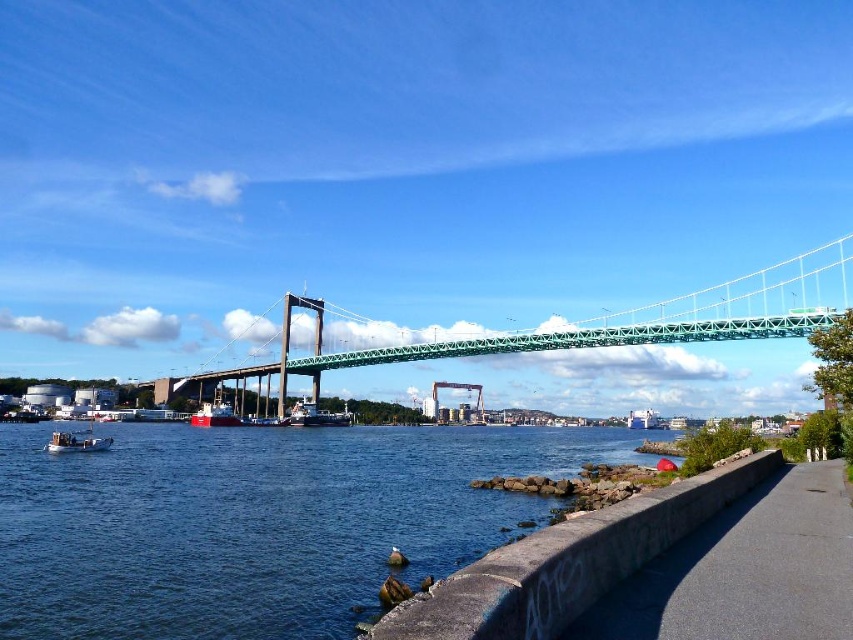
You are standing at the waterfront and want to reach the blue water at lower center. The safety regulations state that you must stay at least 30 meters away from the water for safety. Are you currently within the safe distance?

The distance of blue water at lower center from viewer is 27.16 meters, which is less than the required 30 meters. Therefore, you are not within the safe distance and need to move back.

Based on the photo, you are standing on the green deck of the large suspension bridge and looking down. You see a point labeled with coordinates. Which object is located at point (258, 522)?

The point at coordinates (258, 522) indicates blue water at lower center.

You are a photographer planning to capture the entire view of the waterfront area. You notice the blue water at lower center and the green metallic suspension bridge at center. Which object appears taller in the image?

The green metallic suspension bridge at center appears taller than the blue water at lower center in the image.